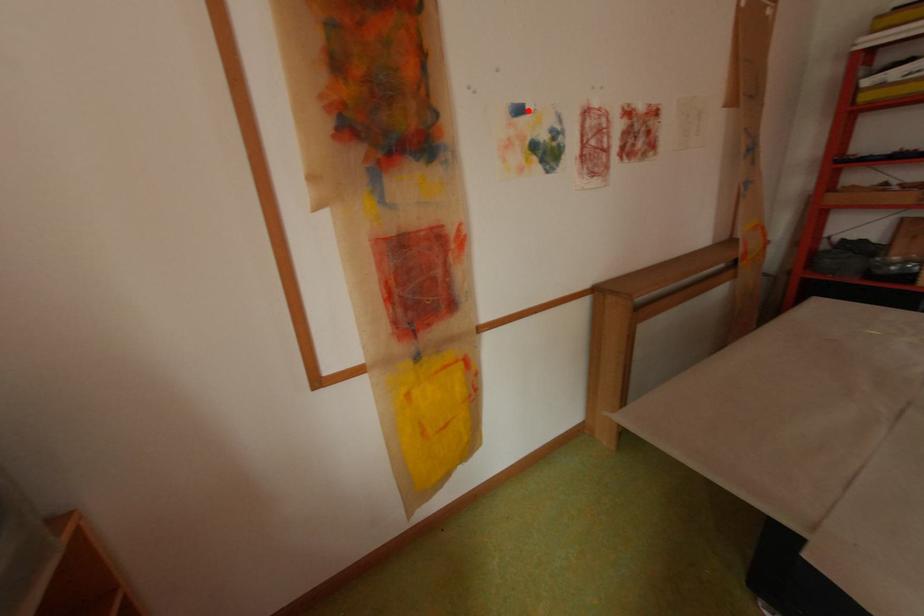
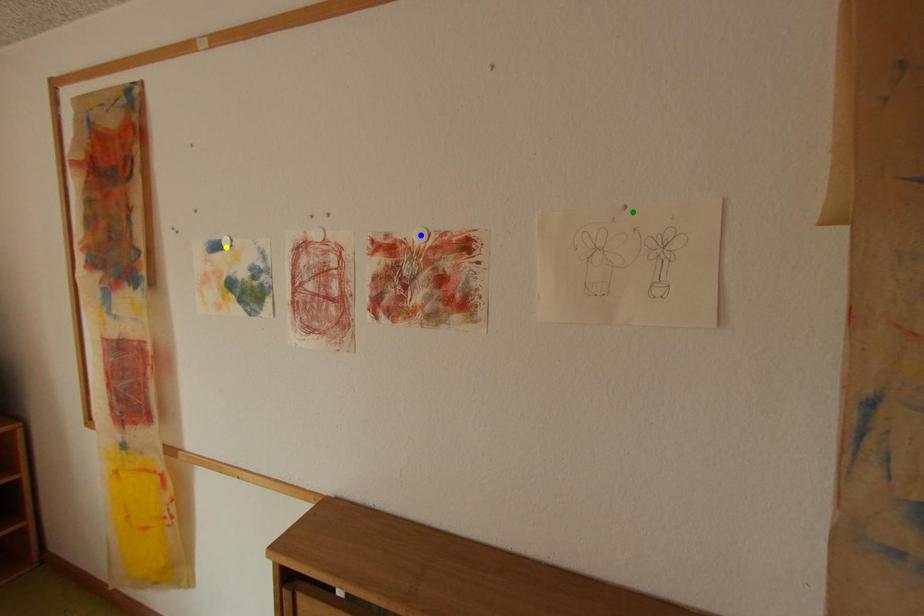
Question: I am providing you with two images of the same scene from different viewpoints. A red point is marked on the first image. You are given multiple points on the second image. In image 2, which mark is for the same physical point as the one in image 1?

Choices:
 (A) green point
 (B) blue point
 (C) yellow point

Answer: (C)